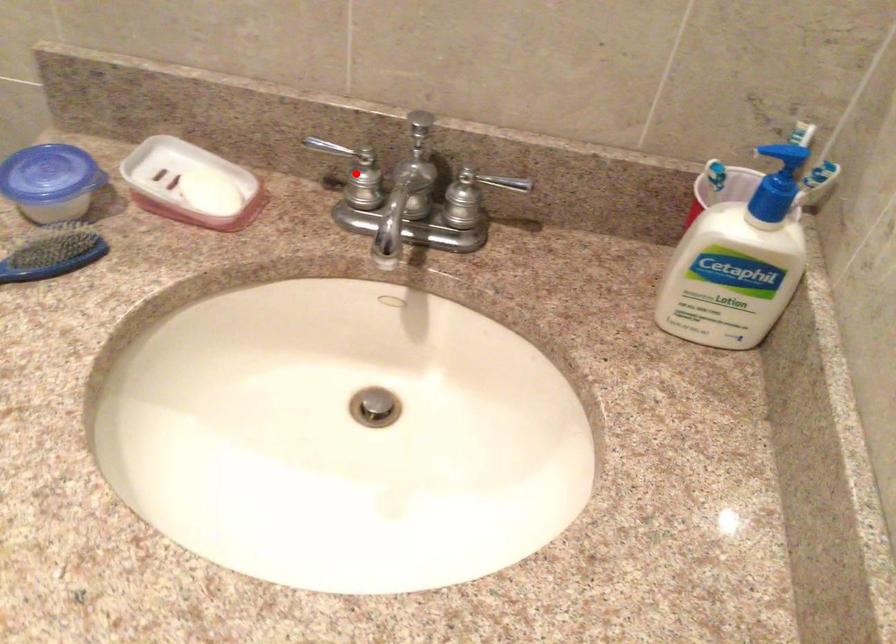
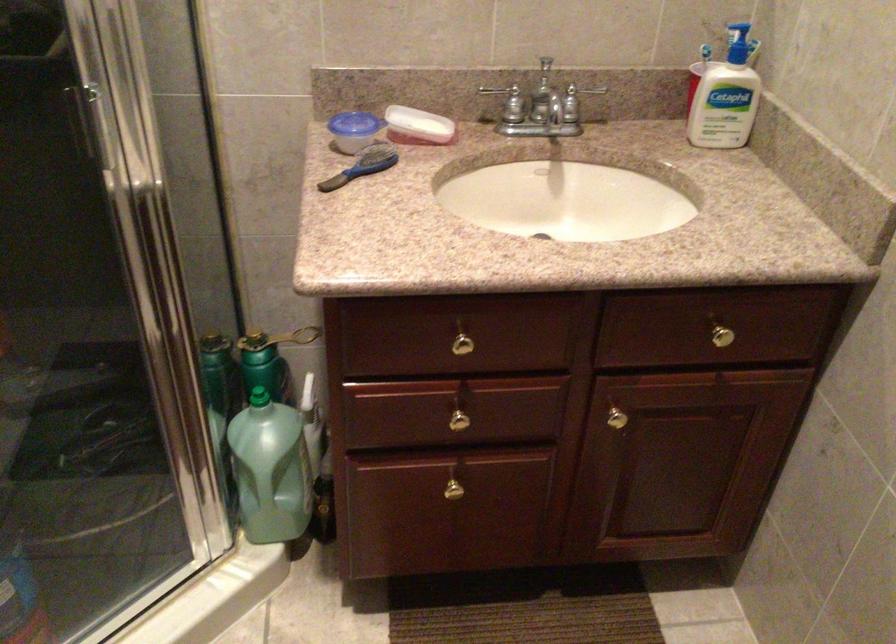
Question: I am providing you with two images of the same scene from different viewpoints. A red point is shown in image1. For the corresponding object point in image2, is it positioned nearer or farther from the camera?

Choices:
 (A) Nearer
 (B) Farther

Answer: (B)